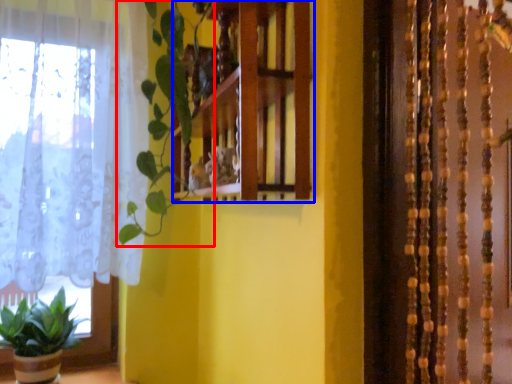
Question: Which of the following is the farthest to the observer, vegetation (highlighted by a red box) or shelf (highlighted by a blue box)?

Choices:
 (A) vegetation
 (B) shelf

Answer: (A)